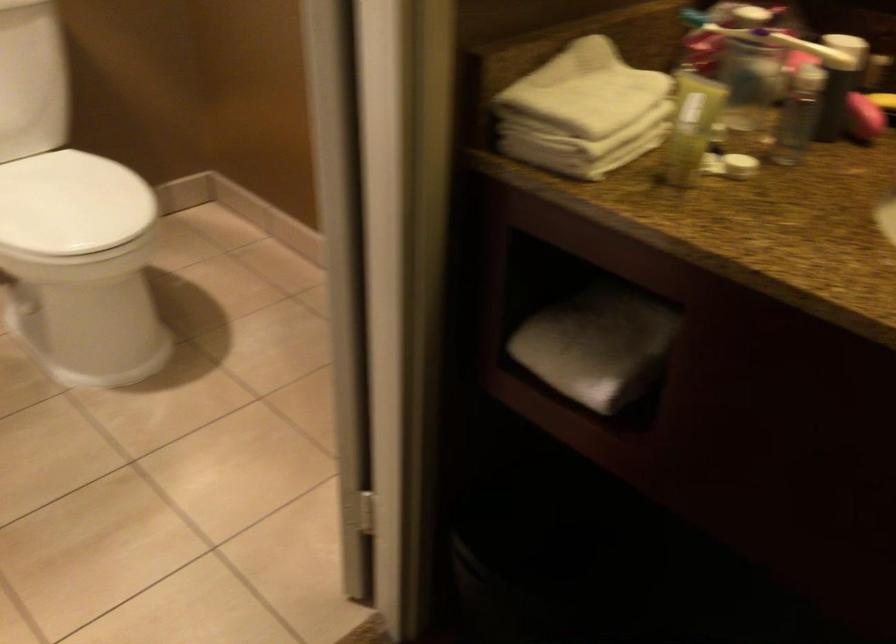
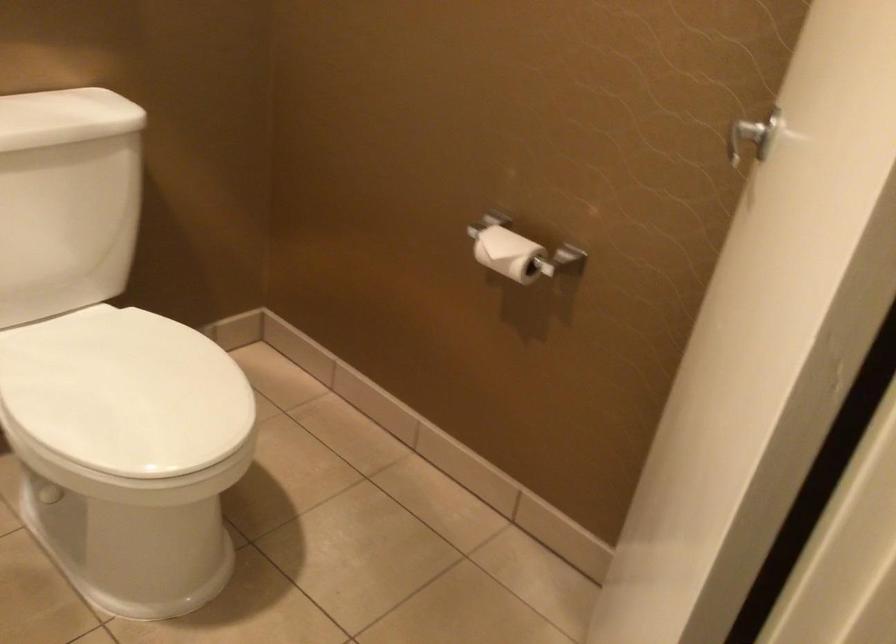
What movement of the cameraman would produce the second image?

The cameraman moved toward left, forward.